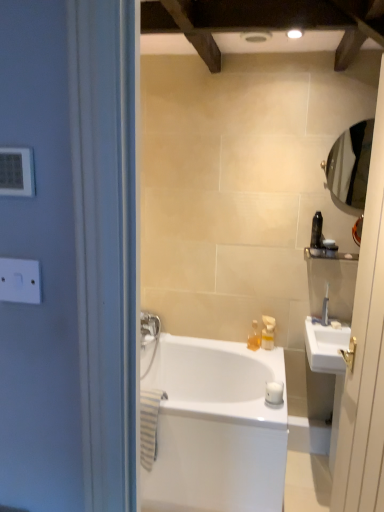
Question: Can you confirm if satin nickel faucet at upper right is shorter than white plastic switch at upper left?

Choices:
 (A) no
 (B) yes

Answer: (A)

Question: Is satin nickel faucet at upper right aimed at white plastic switch at upper left?

Choices:
 (A) no
 (B) yes

Answer: (A)

Question: Does satin nickel faucet at upper right come behind white plastic switch at upper left?

Choices:
 (A) no
 (B) yes

Answer: (B)

Question: Is satin nickel faucet at upper right not inside white plastic switch at upper left?

Choices:
 (A) yes
 (B) no

Answer: (A)

Question: Does satin nickel faucet at upper right have a larger size compared to white plastic switch at upper left?

Choices:
 (A) no
 (B) yes

Answer: (B)

Question: Considering their positions, is matte black toothbrush at upper right, positioned as the 3th toiletry in left-to-right order, located in front of or behind white plastic light switch at upper left?

Choices:
 (A) behind
 (B) front

Answer: (A)

Question: Is matte black toothbrush at upper right, positioned as the 3th toiletry in left-to-right order, bigger or smaller than white plastic light switch at upper left?

Choices:
 (A) small
 (B) big

Answer: (B)

Question: Considering the relative positions of matte black toothbrush at upper right, marked as the second toiletry in a front-to-back arrangement, and white plastic light switch at upper left in the image provided, is matte black toothbrush at upper right, marked as the second toiletry in a front-to-back arrangement, to the left or to the right of white plastic light switch at upper left?

Choices:
 (A) right
 (B) left

Answer: (A)

Question: Is point (329, 250) closer or farther from the camera than point (31, 178)?

Choices:
 (A) farther
 (B) closer

Answer: (A)

Question: Considering the positions of white glossy bathtub at center and translucent plastic bottles at upper center, the 3th toiletry positioned from the top, in the image, is white glossy bathtub at center bigger or smaller than translucent plastic bottles at upper center, the 3th toiletry positioned from the top,?

Choices:
 (A) small
 (B) big

Answer: (B)

Question: In terms of width, does white glossy bathtub at center look wider or thinner when compared to translucent plastic bottles at upper center, which ranks as the 1th toiletry in left-to-right order?

Choices:
 (A) wide
 (B) thin

Answer: (A)

Question: In the image, is white glossy bathtub at center positioned in front of or behind translucent plastic bottles at upper center, which ranks as the 1th toiletry in left-to-right order?

Choices:
 (A) behind
 (B) front

Answer: (B)

Question: From a real-world perspective, is white glossy bathtub at center above or below translucent plastic bottles at upper center, the third toiletry when ordered from front to back?

Choices:
 (A) above
 (B) below

Answer: (B)

Question: From a real-world perspective, is clear glass mirror at right above or below silver metallic mirror at upper right?

Choices:
 (A) below
 (B) above

Answer: (A)

Question: In the image, is clear glass mirror at right positioned in front of or behind silver metallic mirror at upper right?

Choices:
 (A) front
 (B) behind

Answer: (A)